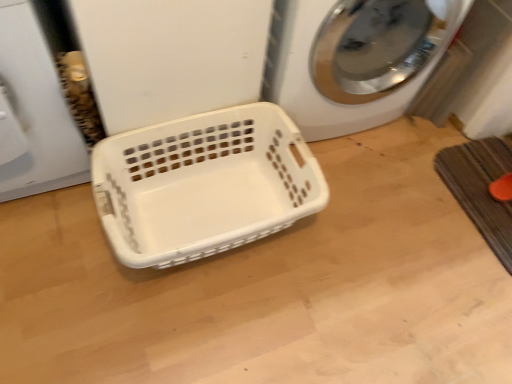
Identify the location of vacant space in brown textured bath mat at lower right (from a real-world perspective). Image resolution: width=512 pixels, height=384 pixels. (483, 181).